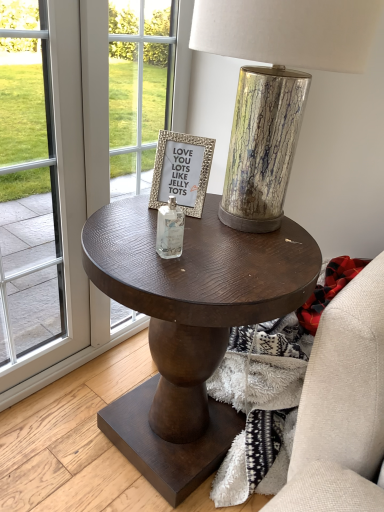
Question: Would you say transparent glass screen door at left is part of metallic cracked glass table lamp at center's contents?

Choices:
 (A) no
 (B) yes

Answer: (A)

Question: Considering the relative positions of metallic cracked glass table lamp at center and transparent glass screen door at left in the image provided, is metallic cracked glass table lamp at center to the right of transparent glass screen door at left from the viewer's perspective?

Choices:
 (A) no
 (B) yes

Answer: (B)

Question: Is metallic cracked glass table lamp at center next to transparent glass screen door at left and touching it?

Choices:
 (A) yes
 (B) no

Answer: (B)

Question: Considering the relative sizes of metallic cracked glass table lamp at center and transparent glass screen door at left in the image provided, is metallic cracked glass table lamp at center bigger than transparent glass screen door at left?

Choices:
 (A) no
 (B) yes

Answer: (B)

Question: Is metallic cracked glass table lamp at center smaller than transparent glass screen door at left?

Choices:
 (A) no
 (B) yes

Answer: (A)

Question: From a real-world perspective, is metallic cracked glass table lamp at center physically above transparent glass screen door at left?

Choices:
 (A) no
 (B) yes

Answer: (B)

Question: Considering the relative sizes of clear glass bottle at center and transparent glass screen door at left in the image provided, is clear glass bottle at center wider than transparent glass screen door at left?

Choices:
 (A) no
 (B) yes

Answer: (A)

Question: Could you tell me if clear glass bottle at center is turned towards transparent glass screen door at left?

Choices:
 (A) yes
 (B) no

Answer: (B)

Question: Can you confirm if clear glass bottle at center is thinner than transparent glass screen door at left?

Choices:
 (A) yes
 (B) no

Answer: (A)

Question: Is clear glass bottle at center positioned beyond the bounds of transparent glass screen door at left?

Choices:
 (A) no
 (B) yes

Answer: (B)

Question: Does clear glass bottle at center lie behind transparent glass screen door at left?

Choices:
 (A) no
 (B) yes

Answer: (B)

Question: Does clear glass bottle at center have a lesser height compared to transparent glass screen door at left?

Choices:
 (A) no
 (B) yes

Answer: (B)

Question: Can you confirm if dark wood side table at center is thinner than gold textured frame at center?

Choices:
 (A) no
 (B) yes

Answer: (A)